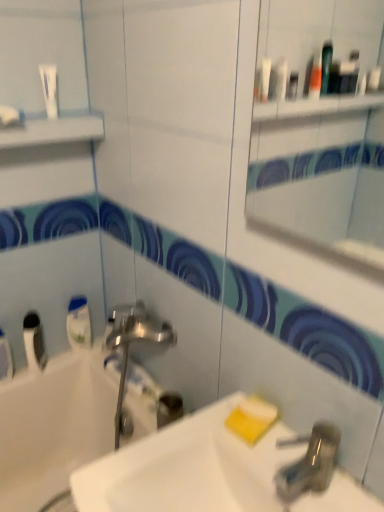
Question: Which direction should I rotate to face yellow sponge at lower center, which ranks as the 1th soap in bottom-to-top order, — up or down?

Choices:
 (A) up
 (B) down

Answer: (B)

Question: Does white opaque tube at lower left, arranged as the 1th mouthwash when viewed from the left, have a larger size compared to yellow matte soap at lower right, which is counted as the 2th soap, starting from the bottom?

Choices:
 (A) no
 (B) yes

Answer: (B)

Question: Can you confirm if white opaque tube at lower left, arranged as the 1th mouthwash when viewed from the left, is positioned to the left of yellow matte soap at lower right, which is counted as the 2th soap, starting from the bottom?

Choices:
 (A) yes
 (B) no

Answer: (A)

Question: Does white opaque tube at lower left, which appears as the second mouthwash when viewed from the right, contain yellow matte soap at lower right, which is counted as the 2th soap, starting from the bottom?

Choices:
 (A) yes
 (B) no

Answer: (B)

Question: From a real-world perspective, is white opaque tube at lower left, arranged as the 1th mouthwash when viewed from the left, located beneath yellow matte soap at lower right, placed as the first soap when sorted from top to bottom?

Choices:
 (A) no
 (B) yes

Answer: (B)

Question: Could you tell me if white opaque tube at lower left, which appears as the second mouthwash when viewed from the right, is turned towards yellow matte soap at lower right, placed as the first soap when sorted from top to bottom?

Choices:
 (A) yes
 (B) no

Answer: (B)

Question: Would you consider white opaque tube at lower left, which appears as the second mouthwash when viewed from the right, to be distant from yellow matte soap at lower right, placed as the first soap when sorted from top to bottom?

Choices:
 (A) no
 (B) yes

Answer: (A)

Question: Considering the relative sizes of yellow matte soap at lower right, which is counted as the 2th soap, starting from the bottom, and white glossy bathtub at lower left in the image provided, is yellow matte soap at lower right, which is counted as the 2th soap, starting from the bottom, smaller than white glossy bathtub at lower left?

Choices:
 (A) yes
 (B) no

Answer: (A)

Question: From the image's perspective, is yellow matte soap at lower right, placed as the first soap when sorted from top to bottom, located beneath white glossy bathtub at lower left?

Choices:
 (A) yes
 (B) no

Answer: (B)

Question: Is white glossy bathtub at lower left a part of yellow matte soap at lower right, placed as the first soap when sorted from top to bottom?

Choices:
 (A) yes
 (B) no

Answer: (B)

Question: Is yellow matte soap at lower right, placed as the first soap when sorted from top to bottom, not close to white glossy bathtub at lower left?

Choices:
 (A) no
 (B) yes

Answer: (A)

Question: Does yellow matte soap at lower right, placed as the first soap when sorted from top to bottom, turn towards white glossy bathtub at lower left?

Choices:
 (A) yes
 (B) no

Answer: (B)

Question: Is yellow matte soap at lower right, which is counted as the 2th soap, starting from the bottom, further to the viewer compared to white glossy bathtub at lower left?

Choices:
 (A) no
 (B) yes

Answer: (A)

Question: Is white glossy mouthwash at left, the 1th mouthwash in the right-to-left sequence, positioned with its back to yellow matte soap at lower right, placed as the first soap when sorted from top to bottom?

Choices:
 (A) no
 (B) yes

Answer: (A)